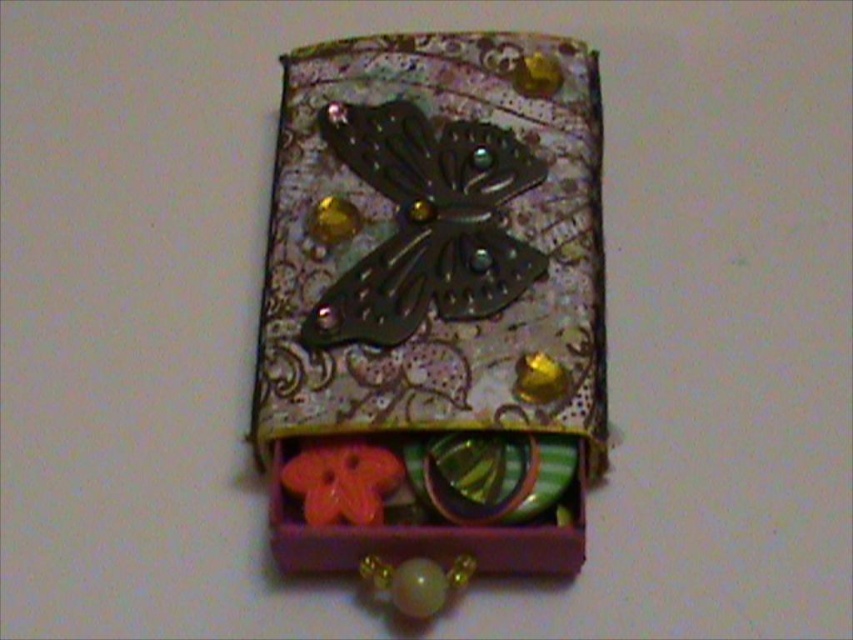
This screenshot has width=853, height=640. Describe the element at coordinates (434, 273) in the screenshot. I see `metallic butterfly at center` at that location.

Between metallic butterfly at center and metallic dark brown butterfly at center, which one is positioned higher?

Positioned higher is metallic dark brown butterfly at center.

Is point (280, 388) positioned after point (489, 180)?

That is False.

At what (x,y) coordinates should I click in order to perform the action: click on metallic butterfly at center. Please return your answer as a coordinate pair (x, y). This screenshot has height=640, width=853. Looking at the image, I should click on (434, 273).

Which is below, metallic butterfly at center or rubberized plastic flower at center?

rubberized plastic flower at center is below.

Can you confirm if metallic butterfly at center is positioned to the left of rubberized plastic flower at center?

Incorrect, metallic butterfly at center is not on the left side of rubberized plastic flower at center.

What are the coordinates of `metallic butterfly at center` in the screenshot? It's located at (434, 273).

Does metallic dark brown butterfly at center appear over rubberized plastic flower at center?

Correct, metallic dark brown butterfly at center is located above rubberized plastic flower at center.

Does metallic dark brown butterfly at center have a larger size compared to rubberized plastic flower at center?

Correct, metallic dark brown butterfly at center is larger in size than rubberized plastic flower at center.

Between point (440, 260) and point (305, 497), which one is positioned in front?

Point (305, 497) is more forward.

In order to click on metallic dark brown butterfly at center in this screenshot , I will do [426, 224].